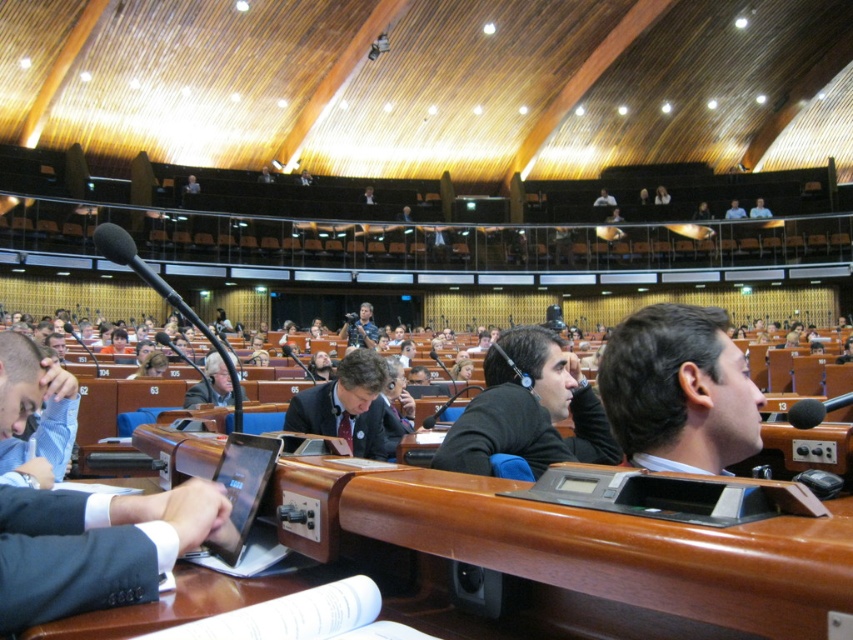
Between dark brown hair at center and gray fabric jacket at center, which one is positioned higher?

dark brown hair at center is higher up.

Is point (693, 410) farther from viewer compared to point (213, 397)?

That is False.

Locate an element on the screen. dark brown hair at center is located at coordinates (679, 388).

Does point (643, 454) come closer to viewer compared to point (612, 440)?

Yes, point (643, 454) is in front of point (612, 440).

Who is more forward, (x=602, y=365) or (x=527, y=429)?

Point (x=602, y=365) is more forward.

The image size is (853, 640). What are the coordinates of `dark brown hair at center` in the screenshot? It's located at (679, 388).

Does black matte suit at center have a greater width compared to light blue shirt at upper right?

No.

Who is lower down, black matte suit at center or light blue shirt at upper right?

black matte suit at center is below.

Is point (561, 451) behind point (735, 202)?

No, (561, 451) is closer to viewer.

Where is `black matte suit at center`? black matte suit at center is located at coordinates (527, 410).